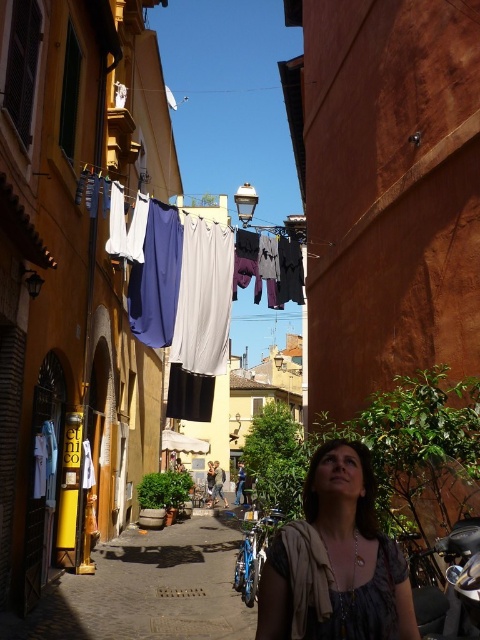
Between matte gray blouse at center and matte white fabric at center, which one appears on the right side from the viewer's perspective?

Positioned to the right is matte gray blouse at center.

From the picture: Who is taller, matte gray blouse at center or matte white fabric at center?

matte white fabric at center

Measure the distance between matte gray blouse at center and camera.

matte gray blouse at center is 9.97 feet from camera.

The height and width of the screenshot is (640, 480). Find the location of `matte gray blouse at center`. matte gray blouse at center is located at coordinates tap(336, 561).